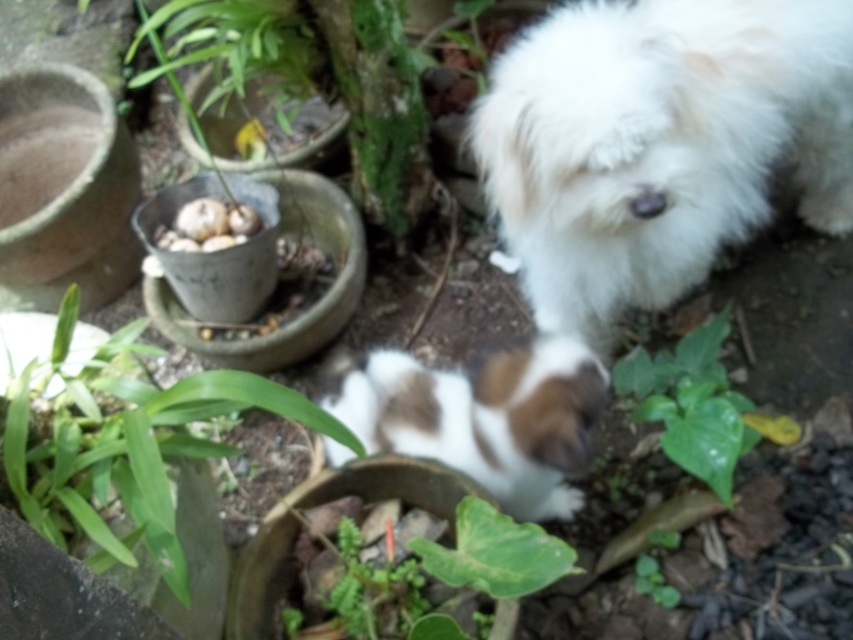
Who is lower down, green leafy plant at lower center or white matte eggs at center?

green leafy plant at lower center is lower down.

Who is positioned more to the right, green leafy plant at lower center or white matte eggs at center?

From the viewer's perspective, green leafy plant at lower center appears more on the right side.

The image size is (853, 640). Identify the location of green leafy plant at lower center. (691, 403).

Can you confirm if brown and white fur at center is shorter than green leafy plant at lower center?

No, brown and white fur at center is not shorter than green leafy plant at lower center.

The image size is (853, 640). What do you see at coordinates (482, 417) in the screenshot?
I see `brown and white fur at center` at bounding box center [482, 417].

You are a GUI agent. You are given a task and a screenshot of the screen. Output one action in this format:
    pyautogui.click(x=<x>, y=<y>)
    Task: Click on the brown and white fur at center
    The width and height of the screenshot is (853, 640).
    Given the screenshot: What is the action you would take?
    pyautogui.click(x=482, y=417)

Is green leafy plant at lower left wider than brown and white fur at center?

Indeed, green leafy plant at lower left has a greater width compared to brown and white fur at center.

Is green leafy plant at lower left smaller than brown and white fur at center?

Incorrect, green leafy plant at lower left is not smaller in size than brown and white fur at center.

Which is behind, point (67, 468) or point (397, 372)?

Point (397, 372)

The width and height of the screenshot is (853, 640). I want to click on green leafy plant at lower left, so click(x=125, y=444).